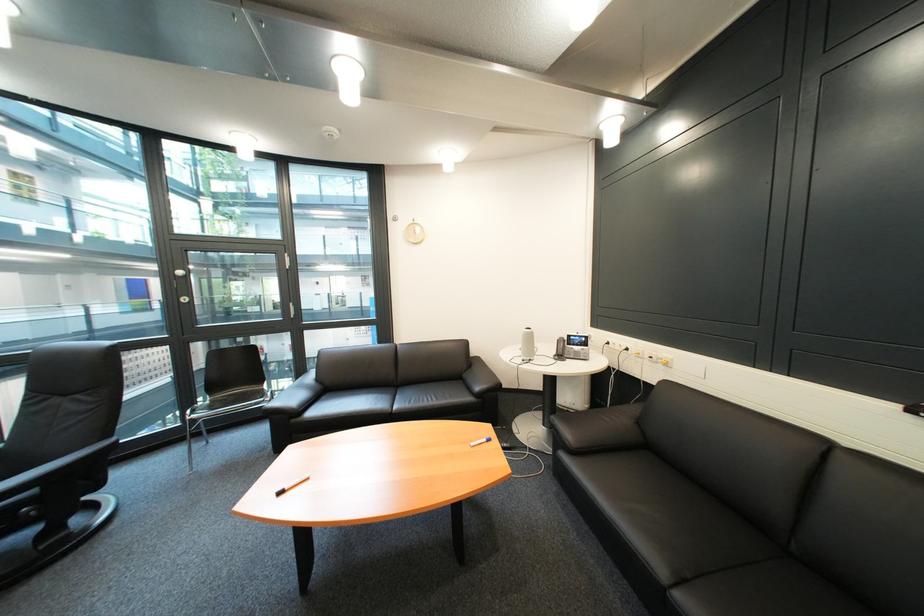
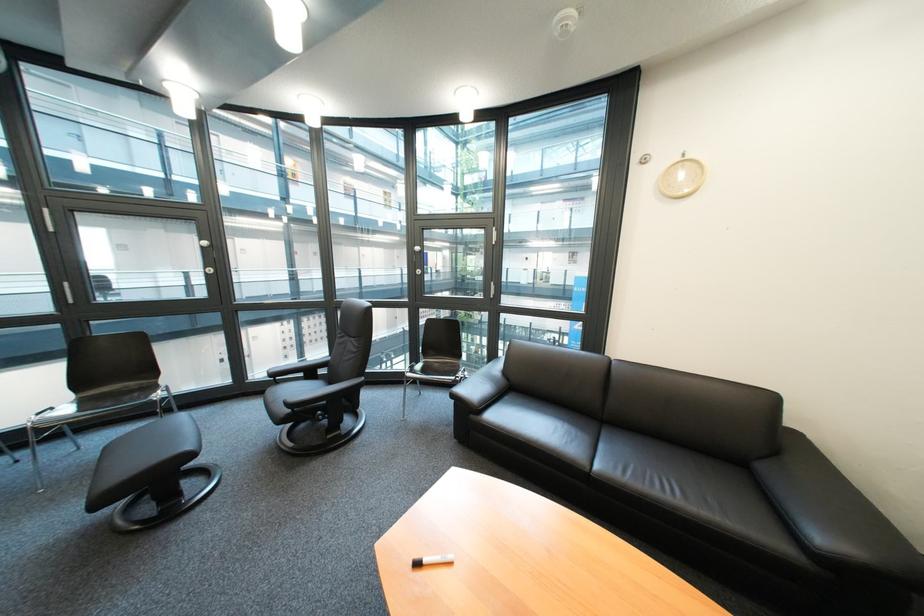
In the second image, find the point that corresponds to pixel 275 400 in the first image.

(467, 379)